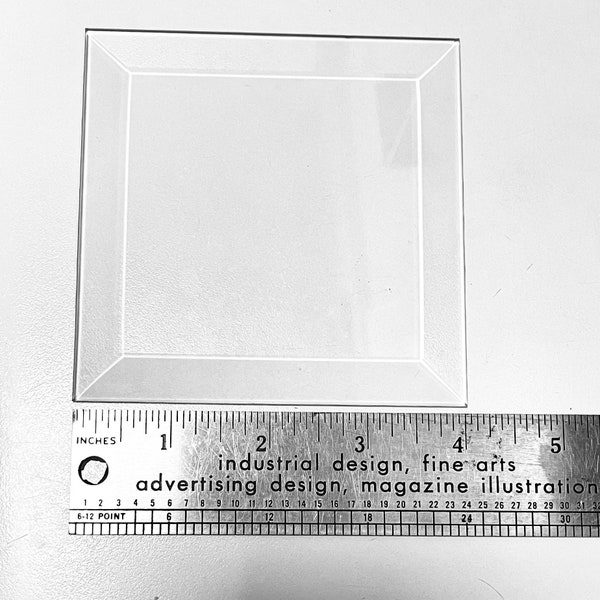
Identify the location of "magazine". (402, 484).